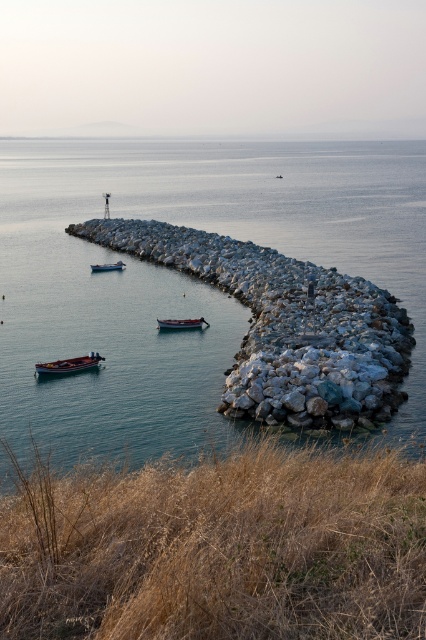
Can you confirm if dry grass at lower center is positioned to the right of wooden boat at center?

Correct, you'll find dry grass at lower center to the right of wooden boat at center.

Between point (293, 481) and point (158, 320), which one is positioned behind?

The point (158, 320) is more distant.

Find the location of a particular element. dry grass at lower center is located at coordinates (219, 548).

How distant is dry grass at lower center from blue painted wooden boat at left?

dry grass at lower center is 97.04 feet from blue painted wooden boat at left.

Can you confirm if dry grass at lower center is positioned to the left of blue painted wooden boat at left?

In fact, dry grass at lower center is to the right of blue painted wooden boat at left.

You are a GUI agent. You are given a task and a screenshot of the screen. Output one action in this format:
    pyautogui.click(x=<x>, y=<y>)
    Task: Click on the dry grass at lower center
    
    Given the screenshot: What is the action you would take?
    pyautogui.click(x=219, y=548)

Is clear blue water at center positioned in front of blue painted wooden boat at left?

Yes, clear blue water at center is in front of blue painted wooden boat at left.

Looking at this image, is clear blue water at center above blue painted wooden boat at left?

Yes, clear blue water at center is above blue painted wooden boat at left.

Which is behind, point (192, 148) or point (98, 268)?

Point (192, 148)

This screenshot has width=426, height=640. In order to click on clear blue water at center in this screenshot , I will do `click(181, 276)`.